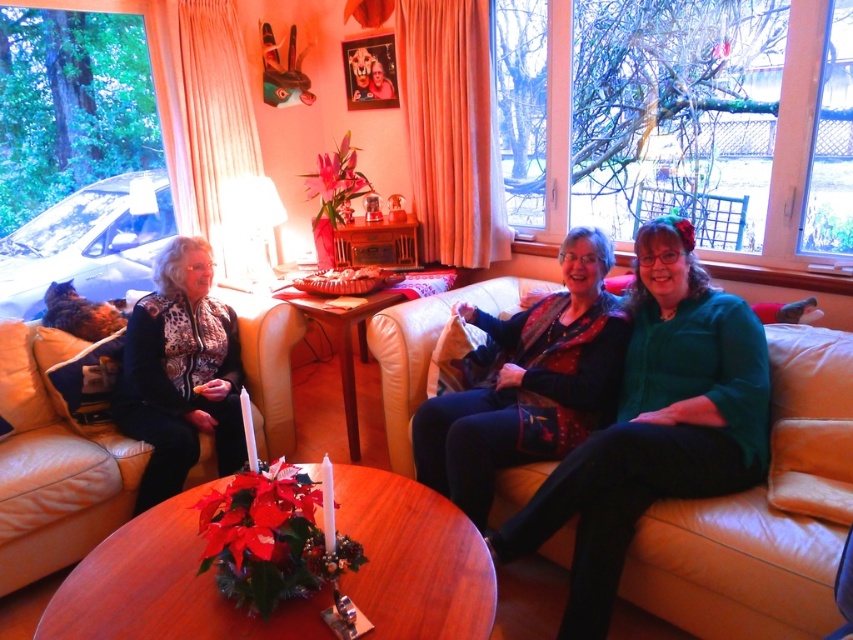
Which is above, leather couch at center or velvet green sweater at center?

Positioned higher is velvet green sweater at center.

Who is positioned more to the left, leather couch at center or velvet green sweater at center?

Positioned to the left is velvet green sweater at center.

Between point (392, 368) and point (589, 372), which one is positioned behind?

Point (392, 368)

In order to click on leather couch at center in this screenshot , I will do `click(737, 566)`.

Who is taller, leather couch at center or patterned fabric jacket at left?

Standing taller between the two is patterned fabric jacket at left.

Which is more to the right, leather couch at center or patterned fabric jacket at left?

From the viewer's perspective, leather couch at center appears more on the right side.

Where is `leather couch at center`? leather couch at center is located at coordinates (737, 566).

Who is shorter, velvet green sweater at center or patterned fabric jacket at left?

Standing shorter between the two is velvet green sweater at center.

Can you confirm if velvet green sweater at center is positioned to the right of patterned fabric jacket at left?

Indeed, velvet green sweater at center is positioned on the right side of patterned fabric jacket at left.

This screenshot has height=640, width=853. What do you see at coordinates (527, 384) in the screenshot? I see `velvet green sweater at center` at bounding box center [527, 384].

The width and height of the screenshot is (853, 640). Find the location of `velvet green sweater at center`. velvet green sweater at center is located at coordinates (527, 384).